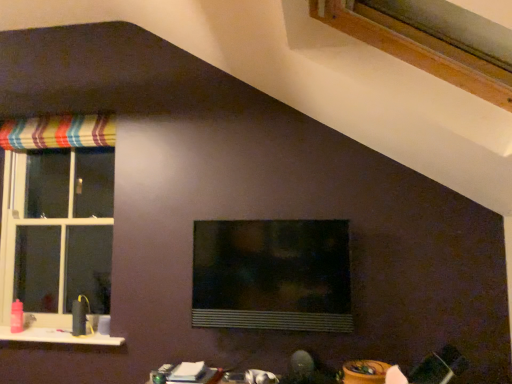
Question: From a real-world perspective, is white glossy table at lower center on wooden frame at upper right, acting as the 3th window starting from the back?

Choices:
 (A) no
 (B) yes

Answer: (A)

Question: From the image's perspective, is white glossy table at lower center above wooden frame at upper right, acting as the 1th window starting from the right?

Choices:
 (A) yes
 (B) no

Answer: (B)

Question: Considering the relative sizes of white glossy table at lower center and wooden frame at upper right, acting as the 3th window starting from the back, in the image provided, is white glossy table at lower center thinner than wooden frame at upper right, acting as the 3th window starting from the back,?

Choices:
 (A) no
 (B) yes

Answer: (B)

Question: Does white glossy table at lower center have a greater height compared to wooden frame at upper right, acting as the 1th window starting from the right?

Choices:
 (A) yes
 (B) no

Answer: (B)

Question: Is white glossy table at lower center aimed at wooden frame at upper right, placed as the first window when sorted from front to back?

Choices:
 (A) yes
 (B) no

Answer: (B)

Question: Is white glossy table at lower center placed right next to wooden frame at upper right, acting as the 3th window starting from the back?

Choices:
 (A) no
 (B) yes

Answer: (A)

Question: Does white plastic window at left, the third window from the front, contain white glossy window sill at lower left?

Choices:
 (A) no
 (B) yes

Answer: (A)

Question: From the image's perspective, is white plastic window at left, arranged as the 1th window when viewed from the left, beneath white glossy window sill at lower left?

Choices:
 (A) yes
 (B) no

Answer: (B)

Question: Is white plastic window at left, the third window from the front, touching white glossy window sill at lower left?

Choices:
 (A) no
 (B) yes

Answer: (A)

Question: Considering the relative sizes of white plastic window at left, the third window from the front, and white glossy window sill at lower left in the image provided, is white plastic window at left, the third window from the front, thinner than white glossy window sill at lower left?

Choices:
 (A) yes
 (B) no

Answer: (A)

Question: Considering the relative positions of white plastic window at left, arranged as the 1th window when viewed from the left, and white glossy window sill at lower left in the image provided, is white plastic window at left, arranged as the 1th window when viewed from the left, to the left of white glossy window sill at lower left from the viewer's perspective?

Choices:
 (A) yes
 (B) no

Answer: (A)

Question: From a real-world perspective, is white plastic window at left, the third window from the front, located higher than white glossy window sill at lower left?

Choices:
 (A) yes
 (B) no

Answer: (A)

Question: From a real-world perspective, is transparent glass window at center, the 2th window positioned from the right, under white plastic window at left, which ranks as the third window in right-to-left order?

Choices:
 (A) no
 (B) yes

Answer: (B)